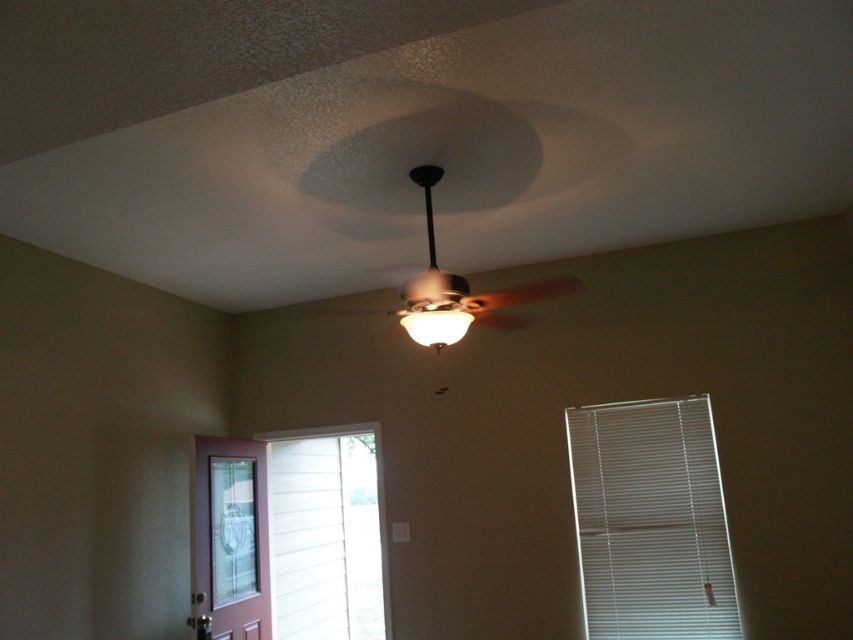
You are standing in the room looking at the ceiling fan. There are two points marked on the ceiling fan blades. Which point, point (445, 280) or point (410, 332), is closer to you?

Point (445, 280) is closer to the viewer than point (410, 332).

Consider the image. You are standing in the middle of the room and notice two objects at the center of the ceiling. One is the metallic silver fan at center and the other is the matte white lamp at center. Which one is positioned to the right of the other?

The metallic silver fan at center is to the right of the matte white lamp at center according to the description.

You are standing in the room and want to adjust the white plastic blinds at right and the metallic silver fan at center. Which object will require you to move closer to reach it?

The white plastic blinds at right is further to the viewer than the metallic silver fan at center, so you need to move closer to reach the metallic silver fan at center.